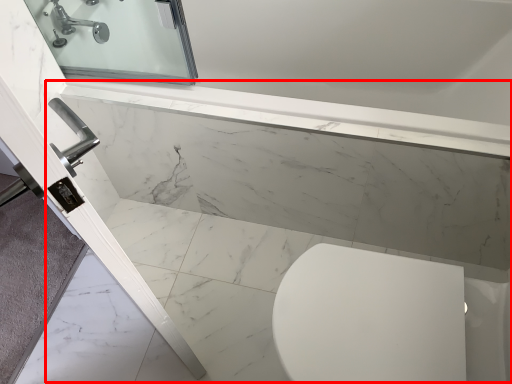
Question: From the image, what is the correct spatial relationship of bath (annotated by the red box) in relation to tap?

Choices:
 (A) left
 (B) right

Answer: (B)